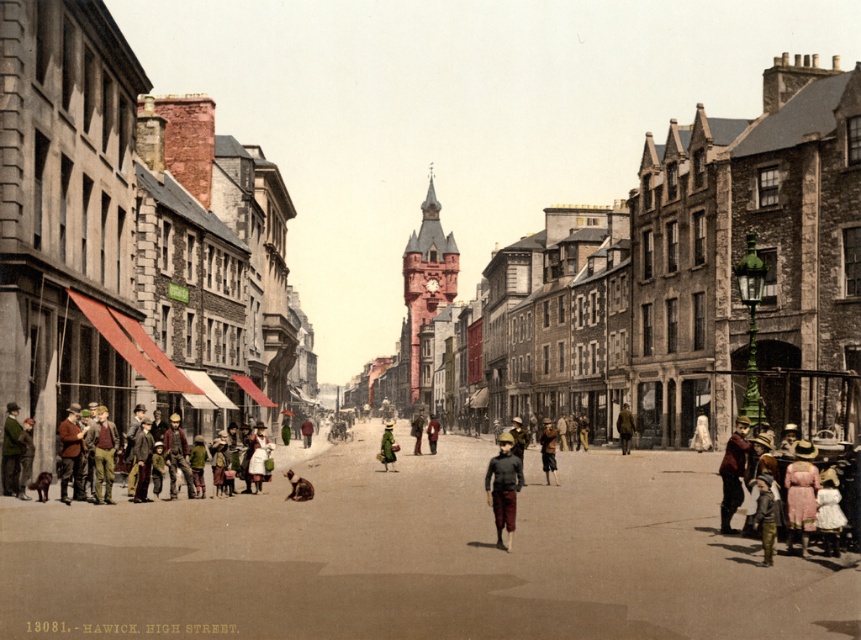
You are a tailor in Hawick High Street looking for a coat to repair. You see the brown wool coat at left in the scene. Where exactly is it located in the image?

The brown wool coat at left is located at point (71, 444) in the image.

You are a photographer standing on Hawick High Street and notice two people in the crowd. One is wearing a green fabric coat at center and the other a light brown fabric dress at center. Which clothing item is positioned higher on their respective bodies?

The green fabric coat at center is located above the light brown fabric dress at center, so the green fabric coat at center is positioned higher on their respective bodies.

You are a tailor observing two brown wool coats on display in a shop window on Hawick High Street. The coats are labeled as the brown wool coat at left and the brown wool coat at center. Which coat would you recommend to a customer who prefers a more compact size?

The brown wool coat at left has a smaller size compared to the brown wool coat at center, so it would be the better recommendation for a customer preferring a more compact size.